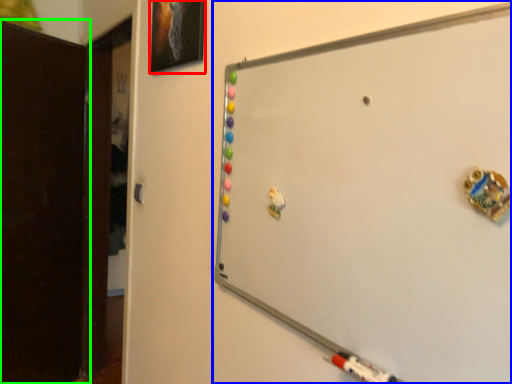
Question: Which object is positioned farthest from picture frame (highlighted by a red box)? Select from whiteboard (highlighted by a blue box) and door (highlighted by a green box).

Choices:
 (A) whiteboard
 (B) door

Answer: (B)